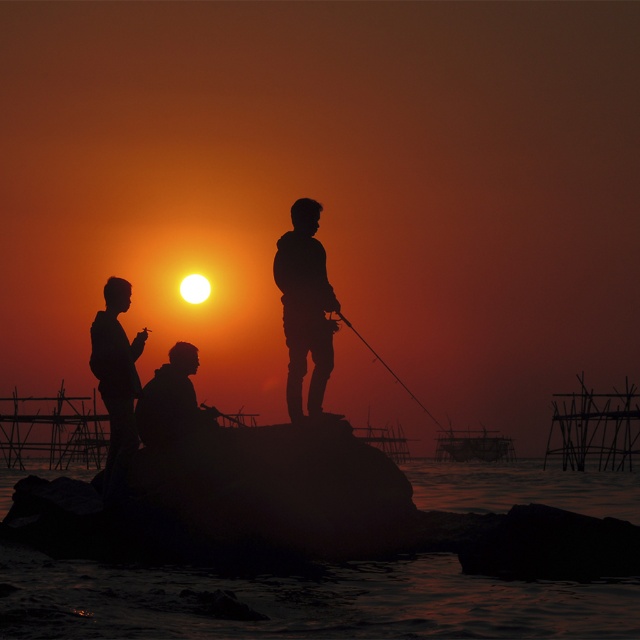
Between dark water at center and silhouette figure at center, which one is positioned higher?

Positioned higher is silhouette figure at center.

Is point (417, 624) positioned in front of point (316, 330)?

Yes, it is in front of point (316, 330).

Is point (58, 616) farther from camera compared to point (310, 404)?

No, it is in front of (310, 404).

The height and width of the screenshot is (640, 640). What are the coordinates of `dark water at center` in the screenshot? It's located at (307, 602).

Is dark water at center positioned in front of silvery metallic fishing pole at center?

Yes, it is in front of silvery metallic fishing pole at center.

Who is more distant from viewer, (100, 604) or (372, 353)?

Point (372, 353)

In order to click on dark water at center in this screenshot , I will do `click(307, 602)`.

Who is positioned more to the left, silhouette figure at center or silvery metallic fishing pole at center?

From the viewer's perspective, silhouette figure at center appears more on the left side.

Which of these two, silhouette figure at center or silvery metallic fishing pole at center, stands taller?

With more height is silvery metallic fishing pole at center.

Who is more distant from viewer, (307, 221) or (346, 323)?

Positioned behind is point (346, 323).

At what (x,y) coordinates should I click in order to perform the action: click on silhouette figure at center. Please return your answer as a coordinate pair (x, y). Looking at the image, I should click on (305, 307).